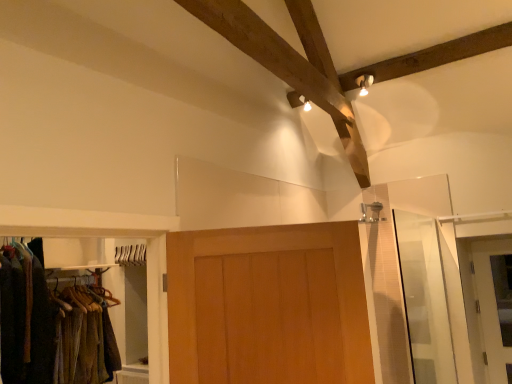
Question: From a real-world perspective, is transparent glass screen door at right on wooden door at center, the first door in the front-to-back sequence?

Choices:
 (A) no
 (B) yes

Answer: (A)

Question: From a real-world perspective, is transparent glass screen door at right under wooden door at center, placed as the first door when sorted from left to right?

Choices:
 (A) yes
 (B) no

Answer: (A)

Question: Considering the relative sizes of transparent glass screen door at right and wooden door at center, the 2th door in the back-to-front sequence, in the image provided, is transparent glass screen door at right shorter than wooden door at center, the 2th door in the back-to-front sequence,?

Choices:
 (A) yes
 (B) no

Answer: (B)

Question: Is transparent glass screen door at right wider than wooden door at center, the 2th door in the back-to-front sequence?

Choices:
 (A) no
 (B) yes

Answer: (A)

Question: Does transparent glass screen door at right appear on the right side of wooden door at center, placed as the first door when sorted from left to right?

Choices:
 (A) no
 (B) yes

Answer: (B)

Question: Is transparent glass screen door at right facing away from wooden door at center, the 2th door positioned from the right?

Choices:
 (A) yes
 (B) no

Answer: (B)

Question: Does white glossy door at right, positioned as the 2th door in left-to-right order, appear on the right side of wooden door at center, the 2th door positioned from the right?

Choices:
 (A) no
 (B) yes

Answer: (B)

Question: From the image's perspective, is white glossy door at right, which is counted as the 1th door, starting from the back, below wooden door at center, placed as the first door when sorted from left to right?

Choices:
 (A) no
 (B) yes

Answer: (B)

Question: From a real-world perspective, is white glossy door at right, the second door viewed from the front, physically above wooden door at center, the 2th door in the back-to-front sequence?

Choices:
 (A) no
 (B) yes

Answer: (A)

Question: Is white glossy door at right, which is counted as the 1th door, starting from the back, aimed at wooden door at center, the 2th door positioned from the right?

Choices:
 (A) yes
 (B) no

Answer: (B)

Question: Are white glossy door at right, the second door viewed from the front, and wooden door at center, the 2th door positioned from the right, beside each other?

Choices:
 (A) yes
 (B) no

Answer: (B)

Question: Is wooden door at center, the 2th door positioned from the right, surrounded by white glossy door at right, placed as the first door when sorted from right to left?

Choices:
 (A) yes
 (B) no

Answer: (B)

Question: Is white glossy door at right, placed as the first door when sorted from right to left, wider than transparent glass screen door at right?

Choices:
 (A) yes
 (B) no

Answer: (B)